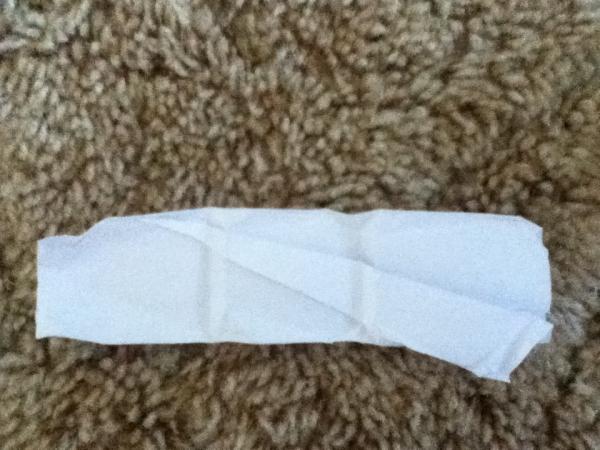
Locate an element on the screen. crease line in white fabric is located at coordinates (210, 282), (366, 235).